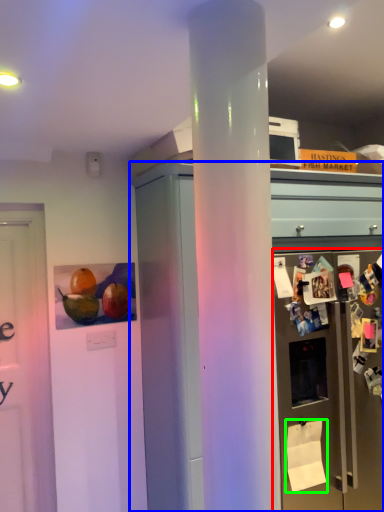
Question: Which object is positioned closest to refrigerator (highlighted by a red box)? Select from cabinetry (highlighted by a blue box) and toilet paper (highlighted by a green box).

Choices:
 (A) cabinetry
 (B) toilet paper

Answer: (A)